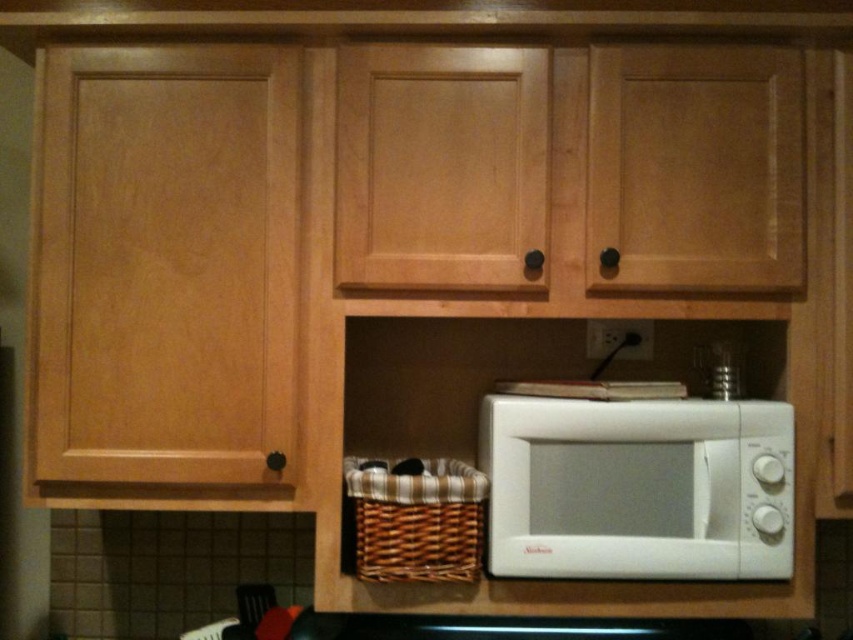
You are standing in the kitchen scene and need to place a new appliance. The appliance must be placed exactly at the coordinates given for the white matte microwave at lower right. Is there already an object occupying that location?

Yes, the white matte microwave at lower right is already located at the coordinates provided.

You are organizing the kitchen and want to place a new spice rack between the white matte microwave at lower right and the woven brown basket at lower center. Based on their positions, where should you place the spice rack?

The white matte microwave at lower right is in front of the woven brown basket at lower center, so you should place the spice rack behind the microwave but in front of the basket to maintain their spatial relationship.

Looking at this image, you are organizing the kitchen and want to place a new spice rack that requires a shelf at least 15 inches tall. Looking at the white matte microwave at lower right and the woven brown basket at lower center, which one has a shelf that meets this height requirement?

The white matte microwave at lower right is much taller than the woven brown basket at lower center, so the shelf where the white matte microwave is placed meets the height requirement of 15 inches.